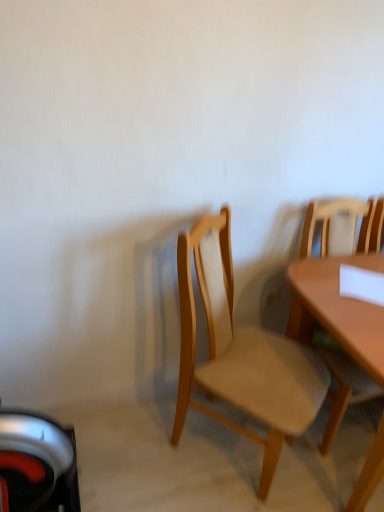
This screenshot has height=512, width=384. In order to click on light brown wood chair at center, marked as the 2th chair in a right-to-left arrangement in this screenshot , I will do `click(241, 352)`.

What do you see at coordinates (241, 352) in the screenshot? I see `light brown wood chair at center, marked as the 2th chair in a right-to-left arrangement` at bounding box center [241, 352].

I want to click on light brown wood chair at right, marked as the 1th chair in a right-to-left arrangement, so click(340, 226).

What do you see at coordinates (340, 226) in the screenshot?
I see `light brown wood chair at right, marked as the 1th chair in a right-to-left arrangement` at bounding box center [340, 226].

Find the location of `light brown wood chair at center, marked as the 2th chair in a right-to-left arrangement`. light brown wood chair at center, marked as the 2th chair in a right-to-left arrangement is located at coordinates (241, 352).

Considering the positions of objects light brown wood chair at right, marked as the 1th chair in a right-to-left arrangement, and light brown wood chair at center, arranged as the 1th chair when viewed from the left, in the image provided, who is more to the right, light brown wood chair at right, marked as the 1th chair in a right-to-left arrangement, or light brown wood chair at center, arranged as the 1th chair when viewed from the left,?

light brown wood chair at right, marked as the 1th chair in a right-to-left arrangement.

Which object is closer to the camera taking this photo, light brown wood chair at right, marked as the 1th chair in a right-to-left arrangement, or light brown wood chair at center, arranged as the 1th chair when viewed from the left?

light brown wood chair at center, arranged as the 1th chair when viewed from the left.

Between point (355, 225) and point (186, 399), which one is positioned behind?

Positioned behind is point (355, 225).

Based on the photo, from the image's perspective, is light brown wood chair at right, positioned as the 2th chair in left-to-right order, over light brown wood chair at center, arranged as the 1th chair when viewed from the left?

Correct, light brown wood chair at right, positioned as the 2th chair in left-to-right order, appears higher than light brown wood chair at center, arranged as the 1th chair when viewed from the left, in the image.

From a real-world perspective, which object rests below the other?

In real-world perspective, light brown wood chair at center, arranged as the 1th chair when viewed from the left, is lower.

Between light brown wood chair at right, marked as the 1th chair in a right-to-left arrangement, and light brown wood chair at center, arranged as the 1th chair when viewed from the left, which one has larger width?

With larger width is light brown wood chair at center, arranged as the 1th chair when viewed from the left.

Is light brown wood chair at right, positioned as the 2th chair in left-to-right order, taller than light brown wood chair at center, arranged as the 1th chair when viewed from the left?

In fact, light brown wood chair at right, positioned as the 2th chair in left-to-right order, may be shorter than light brown wood chair at center, arranged as the 1th chair when viewed from the left.

In the scene shown: Is light brown wood chair at right, marked as the 1th chair in a right-to-left arrangement, smaller than light brown wood chair at center, arranged as the 1th chair when viewed from the left?

Indeed, light brown wood chair at right, marked as the 1th chair in a right-to-left arrangement, has a smaller size compared to light brown wood chair at center, arranged as the 1th chair when viewed from the left.

Does light brown wood chair at right, marked as the 1th chair in a right-to-left arrangement, contain light brown wood chair at center, marked as the 2th chair in a right-to-left arrangement?

No, light brown wood chair at center, marked as the 2th chair in a right-to-left arrangement, is not a part of light brown wood chair at right, marked as the 1th chair in a right-to-left arrangement.

Is light brown wood chair at right, positioned as the 2th chair in left-to-right order, not close to light brown wood chair at center, arranged as the 1th chair when viewed from the left?

They are positioned close to each other.

Is light brown wood chair at right, positioned as the 2th chair in left-to-right order, positioned with its back to light brown wood chair at center, marked as the 2th chair in a right-to-left arrangement?

No.

What's the angular difference between light brown wood chair at right, positioned as the 2th chair in left-to-right order, and light brown wood chair at center, marked as the 2th chair in a right-to-left arrangement,'s facing directions?

They differ by 39.6 degrees in their facing directions.

Locate an element on the screen. This screenshot has width=384, height=512. chair on the left of light brown wood chair at right, marked as the 1th chair in a right-to-left arrangement is located at coordinates (241, 352).

Considering the positions of objects light brown wood chair at center, arranged as the 1th chair when viewed from the left, and light brown wood chair at right, marked as the 1th chair in a right-to-left arrangement, in the image provided, who is more to the left, light brown wood chair at center, arranged as the 1th chair when viewed from the left, or light brown wood chair at right, marked as the 1th chair in a right-to-left arrangement,?

light brown wood chair at center, arranged as the 1th chair when viewed from the left, is more to the left.

Between light brown wood chair at center, marked as the 2th chair in a right-to-left arrangement, and light brown wood chair at right, marked as the 1th chair in a right-to-left arrangement, which one is positioned in front?

light brown wood chair at center, marked as the 2th chair in a right-to-left arrangement.

Between point (220, 296) and point (366, 216), which one is positioned behind?

The point (366, 216) is farther.

From the image's perspective, which one is positioned lower, light brown wood chair at center, marked as the 2th chair in a right-to-left arrangement, or light brown wood chair at right, marked as the 1th chair in a right-to-left arrangement?

light brown wood chair at center, marked as the 2th chair in a right-to-left arrangement, from the image's perspective.

From a real-world perspective, who is located higher, light brown wood chair at center, marked as the 2th chair in a right-to-left arrangement, or light brown wood chair at right, marked as the 1th chair in a right-to-left arrangement?

From a 3D spatial view, light brown wood chair at right, marked as the 1th chair in a right-to-left arrangement, is above.

Does light brown wood chair at center, arranged as the 1th chair when viewed from the left, have a greater width compared to light brown wood chair at right, marked as the 1th chair in a right-to-left arrangement?

Yes.

Who is shorter, light brown wood chair at center, marked as the 2th chair in a right-to-left arrangement, or light brown wood chair at right, marked as the 1th chair in a right-to-left arrangement?

light brown wood chair at right, marked as the 1th chair in a right-to-left arrangement, is shorter.

Which of these two, light brown wood chair at center, arranged as the 1th chair when viewed from the left, or light brown wood chair at right, marked as the 1th chair in a right-to-left arrangement, is bigger?

light brown wood chair at center, arranged as the 1th chair when viewed from the left, is bigger.

Is light brown wood chair at center, arranged as the 1th chair when viewed from the left, situated inside light brown wood chair at right, positioned as the 2th chair in left-to-right order, or outside?

light brown wood chair at center, arranged as the 1th chair when viewed from the left, is outside light brown wood chair at right, positioned as the 2th chair in left-to-right order.

Is light brown wood chair at center, arranged as the 1th chair when viewed from the left, next to light brown wood chair at right, positioned as the 2th chair in left-to-right order, and touching it?

light brown wood chair at center, arranged as the 1th chair when viewed from the left, and light brown wood chair at right, positioned as the 2th chair in left-to-right order, are not in contact.

Is light brown wood chair at right, positioned as the 2th chair in left-to-right order, at the back of light brown wood chair at center, arranged as the 1th chair when viewed from the left?

That's not correct — light brown wood chair at center, arranged as the 1th chair when viewed from the left, is not looking away from light brown wood chair at right, positioned as the 2th chair in left-to-right order.

At what (x,y) coordinates should I click in order to perform the action: click on chair on the right of light brown wood chair at center, arranged as the 1th chair when viewed from the left. Please return your answer as a coordinate pair (x, y). The width and height of the screenshot is (384, 512). Looking at the image, I should click on (340, 226).

The width and height of the screenshot is (384, 512). I want to click on chair positioned vertically above the light brown wood chair at center, arranged as the 1th chair when viewed from the left (from a real-world perspective), so click(x=340, y=226).

This screenshot has width=384, height=512. Identify the location of chair that appears below the light brown wood chair at right, positioned as the 2th chair in left-to-right order (from a real-world perspective). (241, 352).